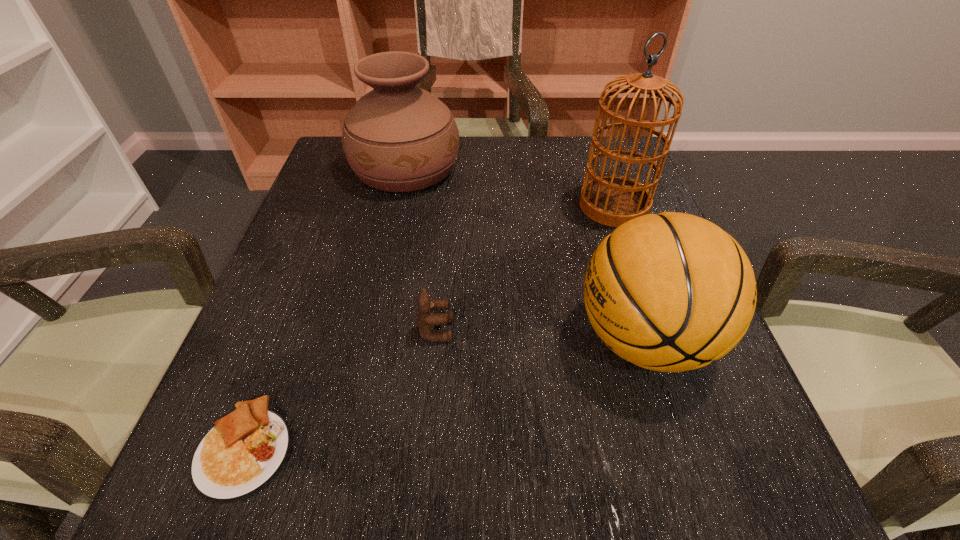
At what (x,y) coordinates should I click in order to perform the action: click on object situated at the near left corner. Please return your answer as a coordinate pair (x, y). Looking at the image, I should click on (238, 457).

The height and width of the screenshot is (540, 960). What are the coordinates of `object at the far right corner` in the screenshot? It's located at (612, 200).

The height and width of the screenshot is (540, 960). Find the location of `free point at the far edge`. free point at the far edge is located at coordinates (488, 161).

Locate an element on the screen. free point at the near edge is located at coordinates (354, 473).

At what (x,y) coordinates should I click in order to perform the action: click on free space at the left edge of the desktop. Please return your answer as a coordinate pair (x, y). The height and width of the screenshot is (540, 960). Looking at the image, I should click on coord(352,192).

In the image, there is a desktop. Identify the location of free space at the right edge. (628, 380).

In the image, there is a desktop. Where is `vacant space at the near left corner`? vacant space at the near left corner is located at coordinates (278, 483).

The height and width of the screenshot is (540, 960). I want to click on blank space at the far right corner of the desktop, so click(603, 174).

Identify the location of free point between the urn and the basketball. (525, 254).

Identify the location of vacant space in between the shortest object and the teddy bear. The height and width of the screenshot is (540, 960). point(341,389).